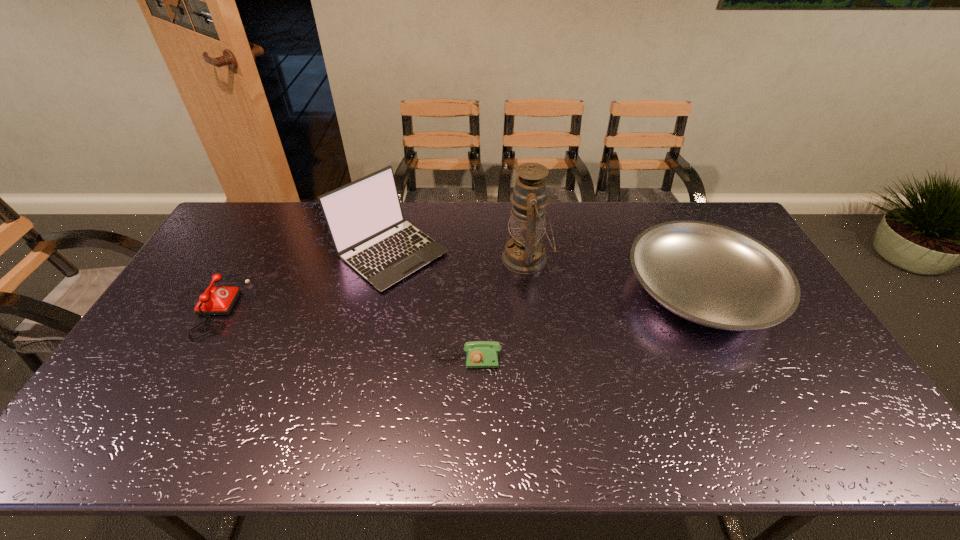
The height and width of the screenshot is (540, 960). Find the location of `vacant space that is in between the rightmost object and the farther telephone`. vacant space that is in between the rightmost object and the farther telephone is located at coordinates (454, 297).

The image size is (960, 540). I want to click on free space between the second object from right to left and the second shortest object, so click(x=367, y=281).

Image resolution: width=960 pixels, height=540 pixels. I want to click on vacant space in between the shortest object and the taller telephone, so click(336, 330).

Where is `object identified as the second closest to the bedpan`? The width and height of the screenshot is (960, 540). object identified as the second closest to the bedpan is located at coordinates (479, 354).

Identify which object is the second nearest to the shorter telephone. Please provide its 2D coordinates. Your answer should be formatted as a tuple, i.e. [(x, y)], where the tuple contains the x and y coordinates of a point satisfying the conditions above.

[(525, 253)]

Image resolution: width=960 pixels, height=540 pixels. Identify the location of vacant space that satisfies the following two spatial constraints: 1. at the front screen of the laptop_computer; 2. on the dial of the fourth tallest object. (379, 304).

What are the coordinates of `free space in the image that satisfies the following two spatial constraints: 1. at the front screen of the fourth object from left to right; 2. on the left side of the laptop_computer` in the screenshot? It's located at (390, 259).

The image size is (960, 540). Find the location of `free space that satisfies the following two spatial constraints: 1. on the front side of the oil lamp; 2. on the dial of the fourth tallest object`. free space that satisfies the following two spatial constraints: 1. on the front side of the oil lamp; 2. on the dial of the fourth tallest object is located at coordinates (532, 304).